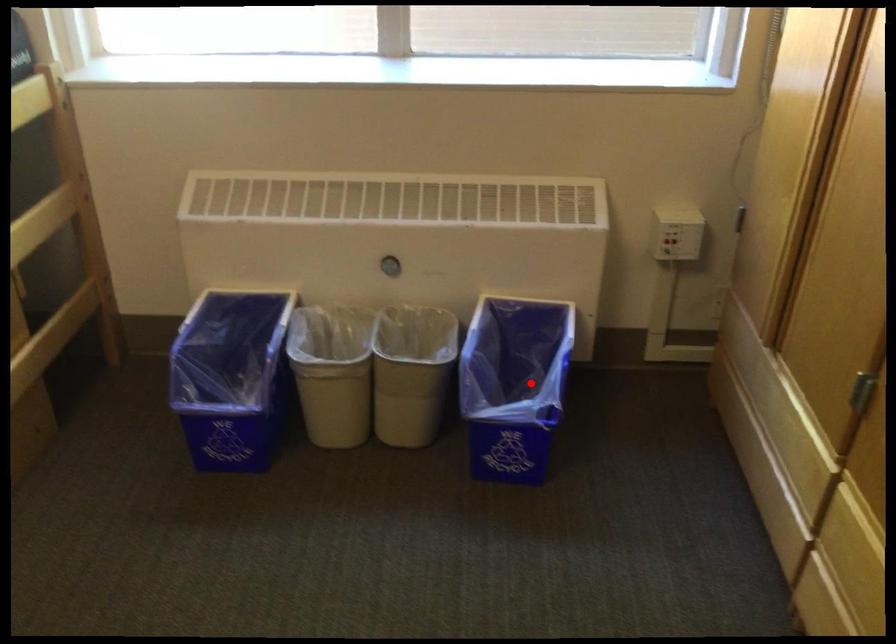
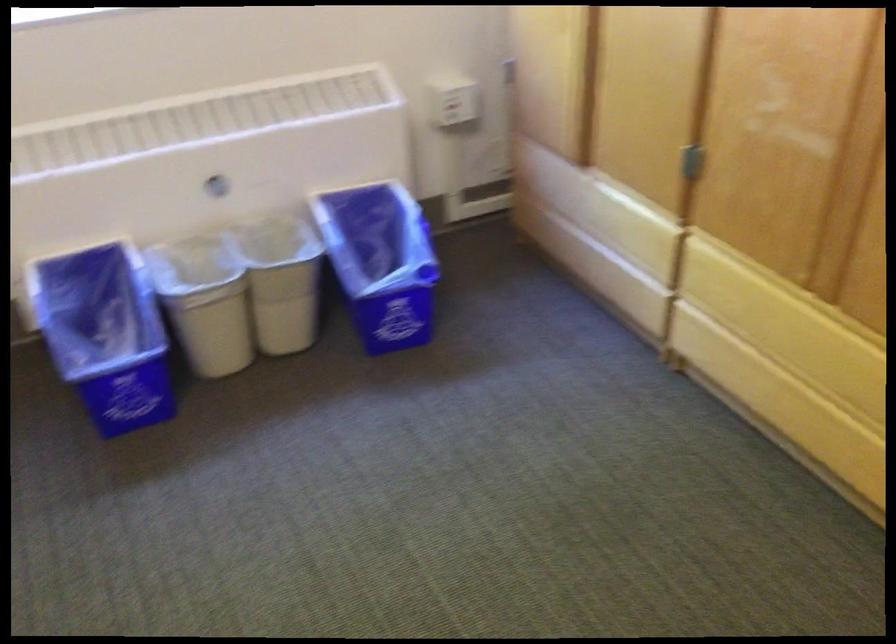
The point at the highlighted location is marked in the first image. Where is the corresponding point in the second image?

(380, 261)